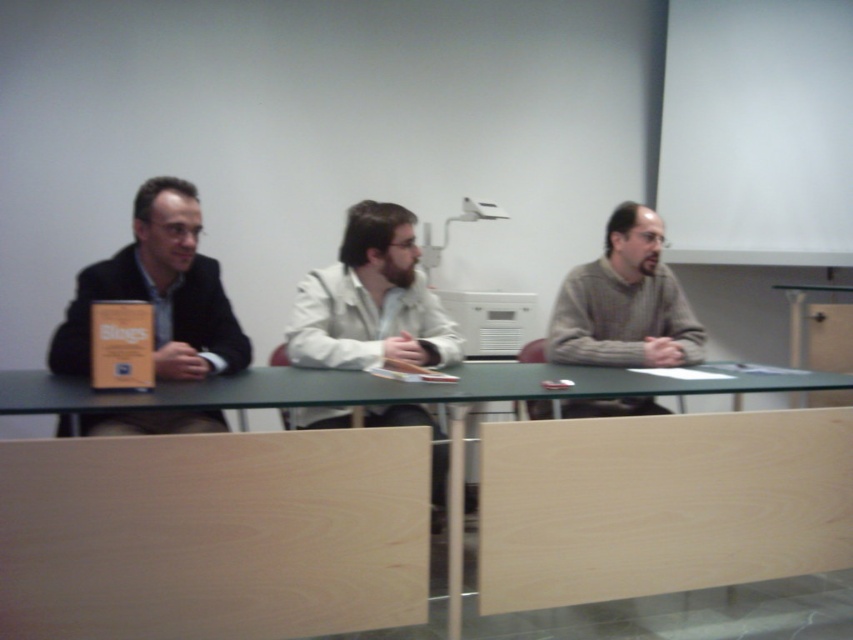
Does green matte table at center have a greater width compared to gray sweater at center?

Yes.

Which is more to the left, green matte table at center or gray sweater at center?

Positioned to the left is green matte table at center.

Which is in front, point (155, 397) or point (614, 220)?

Point (155, 397)

Locate an element on the screen. The height and width of the screenshot is (640, 853). green matte table at center is located at coordinates (253, 392).

Is matte black jacket at left bigger than green matte table at center?

No, matte black jacket at left is not bigger than green matte table at center.

Which is more to the right, matte black jacket at left or green matte table at center?

green matte table at center is more to the right.

Find the location of a particular element. matte black jacket at left is located at coordinates (160, 292).

You are a GUI agent. You are given a task and a screenshot of the screen. Output one action in this format:
    pyautogui.click(x=<x>, y=<y>)
    Task: Click on the matte black jacket at left
    
    Given the screenshot: What is the action you would take?
    [160, 292]

Between matte black jacket at left and gray sweater at center, which one is positioned lower?

Positioned lower is gray sweater at center.

Can you confirm if matte black jacket at left is smaller than gray sweater at center?

No.

In order to click on matte black jacket at left in this screenshot , I will do `click(160, 292)`.

Locate an element on the screen. matte black jacket at left is located at coordinates click(x=160, y=292).